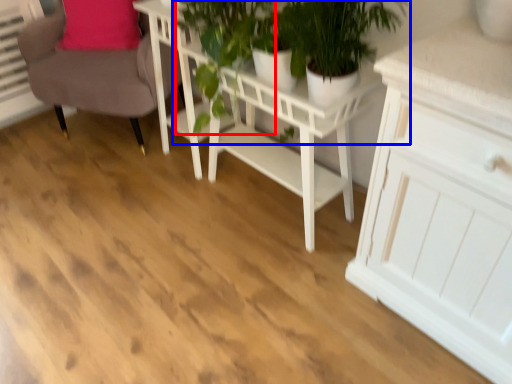
Question: Which object is further to the camera taking this photo, plant (highlighted by a red box) or houseplant (highlighted by a blue box)?

Choices:
 (A) plant
 (B) houseplant

Answer: (A)